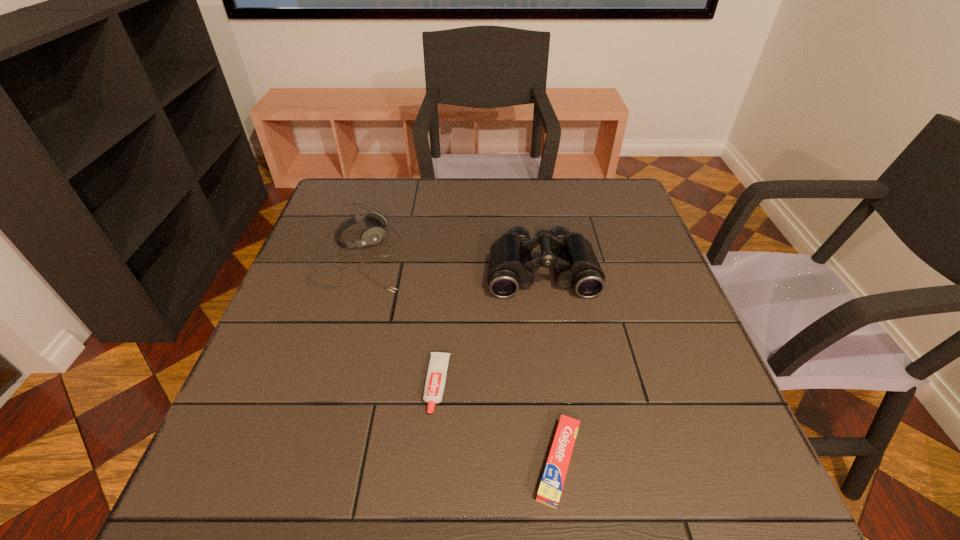
Image resolution: width=960 pixels, height=540 pixels. Identify the location of blank region between the farther toothpaste and the nearest object. (498, 423).

Point out which object is positioned as the nearest to the nearer toothpaste. Please provide its 2D coordinates. Your answer should be formatted as a tuple, i.e. [(x, y)], where the tuple contains the x and y coordinates of a point satisfying the conditions above.

[(436, 375)]

Locate an element on the screen. The width and height of the screenshot is (960, 540). object that stands as the third closest to the nearer toothpaste is located at coordinates (373, 235).

Where is `vacant point that satisfies the following two spatial constraints: 1. on the outer surface of the headset; 2. on the back side of the right toothpaste`? Image resolution: width=960 pixels, height=540 pixels. vacant point that satisfies the following two spatial constraints: 1. on the outer surface of the headset; 2. on the back side of the right toothpaste is located at coordinates (295, 462).

Find the location of `free point that satisfies the following two spatial constraints: 1. on the outer surface of the right toothpaste; 2. on the right side of the headset`. free point that satisfies the following two spatial constraints: 1. on the outer surface of the right toothpaste; 2. on the right side of the headset is located at coordinates (x=295, y=462).

Where is `vacant area that satisfies the following two spatial constraints: 1. on the outer surface of the headset; 2. on the back side of the second object from left to right`? vacant area that satisfies the following two spatial constraints: 1. on the outer surface of the headset; 2. on the back side of the second object from left to right is located at coordinates (320, 384).

Where is `vacant region that satisfies the following two spatial constraints: 1. on the front side of the third object from right to left; 2. on the right side of the nearest object`? This screenshot has height=540, width=960. vacant region that satisfies the following two spatial constraints: 1. on the front side of the third object from right to left; 2. on the right side of the nearest object is located at coordinates (431, 462).

Where is `free spot that satisfies the following two spatial constraints: 1. on the outer surface of the leftmost object; 2. on the right side of the nearer toothpaste`? This screenshot has height=540, width=960. free spot that satisfies the following two spatial constraints: 1. on the outer surface of the leftmost object; 2. on the right side of the nearer toothpaste is located at coordinates (295, 462).

Locate an element on the screen. Image resolution: width=960 pixels, height=540 pixels. vacant point that satisfies the following two spatial constraints: 1. on the outer surface of the leftmost object; 2. on the back side of the nearer toothpaste is located at coordinates (295, 462).